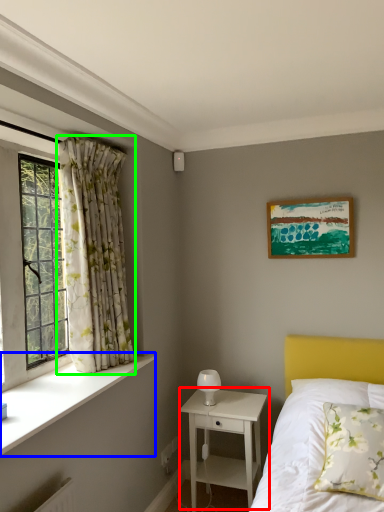
Question: Which is farther away from nightstand (highlighted by a red box)? window sill (highlighted by a blue box) or curtain (highlighted by a green box)?

Choices:
 (A) window sill
 (B) curtain

Answer: (B)